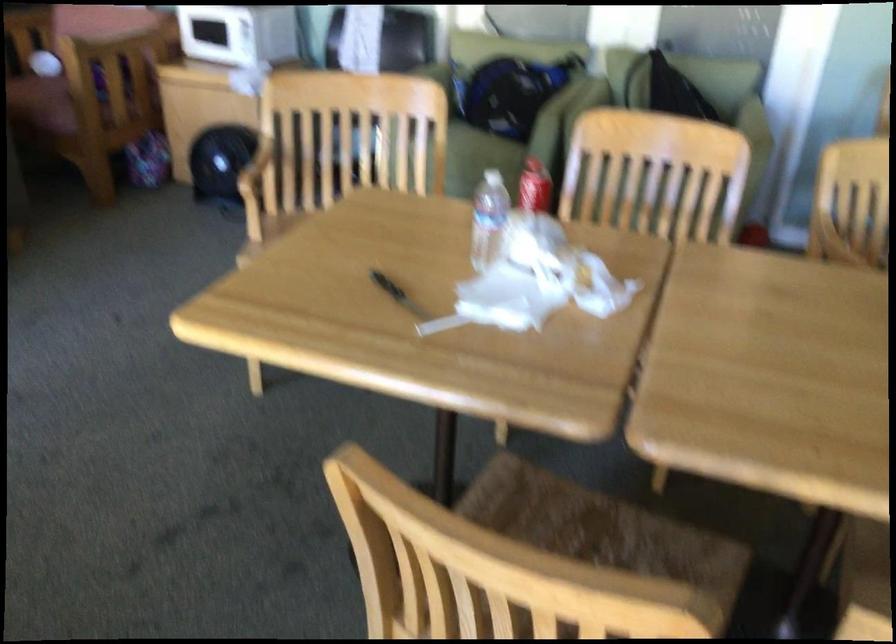
Where would you lift the black handle knife? Please return your answer as a coordinate pair (x, y).

(398, 294)